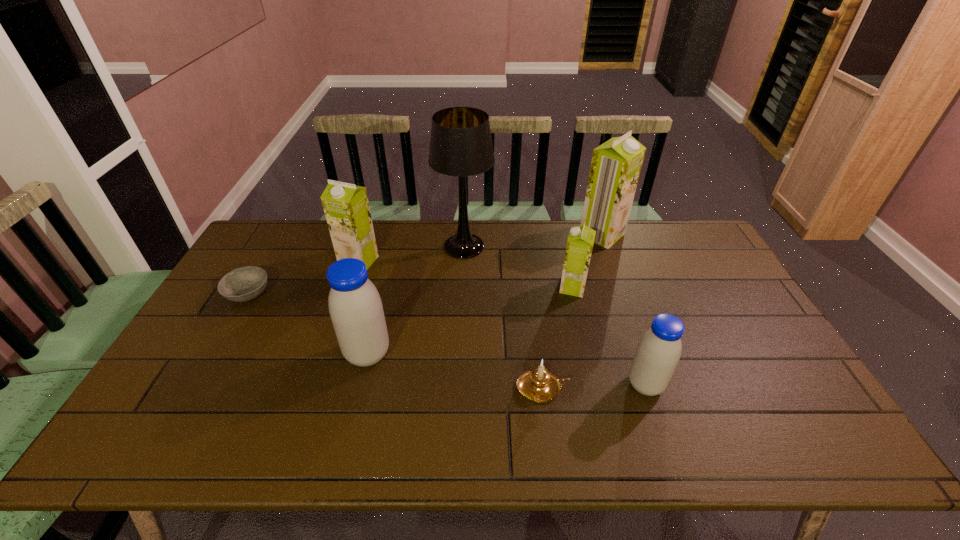
What are the coordinates of `vacant position located on the handle side of the fifth object from left to right` in the screenshot? It's located at (636, 388).

Locate an element on the screen. Image resolution: width=960 pixels, height=540 pixels. vacant space located 0.400m on the front of the shortest object is located at coordinates (168, 433).

Image resolution: width=960 pixels, height=540 pixels. In order to click on table lamp located at the far edge in this screenshot , I will do `click(461, 145)`.

You are a GUI agent. You are given a task and a screenshot of the screen. Output one action in this format:
    pyautogui.click(x=<x>, y=<y>)
    Task: Click on the object present at the left edge
    
    Given the screenshot: What is the action you would take?
    pyautogui.click(x=243, y=284)

Identify the location of vacant space at the far edge. The width and height of the screenshot is (960, 540). (555, 256).

In the image, there is a desktop. What are the coordinates of `vacant space at the near edge` in the screenshot? It's located at (307, 456).

At what (x,y) coordinates should I click in order to perform the action: click on vacant region at the right edge of the desktop. Please return your answer as a coordinate pair (x, y). Looking at the image, I should click on (740, 333).

Find the location of a particular element. This screenshot has width=960, height=540. vacant region at the far left corner of the desktop is located at coordinates (272, 224).

The width and height of the screenshot is (960, 540). I want to click on empty location between the fifth object from left to right and the second green soya milk from right to left, so click(558, 338).

This screenshot has width=960, height=540. What are the coordinates of `empty location between the smaller blue soya milk and the leftmost green soya milk` in the screenshot? It's located at (502, 323).